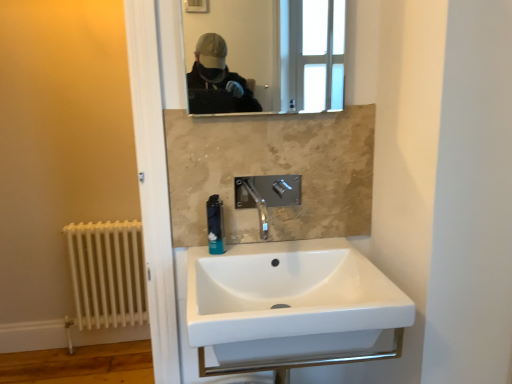
Question: From a real-world perspective, relative to white ceramic sink at center, is polished chrome faucet at center vertically above or below?

Choices:
 (A) above
 (B) below

Answer: (A)

Question: Considering the positions of polished chrome faucet at center and white ceramic sink at center in the image, is polished chrome faucet at center wider or thinner than white ceramic sink at center?

Choices:
 (A) thin
 (B) wide

Answer: (A)

Question: Based on their relative distances, which object is nearer to the blue plastic soap dispenser at center?

Choices:
 (A) white painted metal radiator at lower left
 (B) polished chrome faucet at center
 (C) white ceramic sink at center
 (D) matte glass mirror at upper center

Answer: (B)

Question: Estimate the real-world distances between objects in this image. Which object is farther from the blue plastic soap dispenser at center?

Choices:
 (A) polished chrome faucet at center
 (B) white ceramic sink at center
 (C) white painted metal radiator at lower left
 (D) matte glass mirror at upper center

Answer: (D)